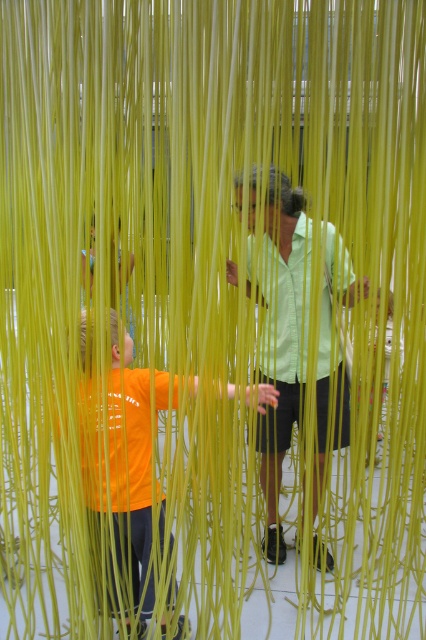
You are an artist planning to install a new sculpture between the orange matte shirt at center and the green textured shirt at center. Based on their positions, where should you place the sculpture so it is between them?

The orange matte shirt at center is located below the green textured shirt at center, so you should place the sculpture between them vertically, positioning it above the orange matte shirt at center and below the green textured shirt at center to ensure it is in between both shirts.

Based on the photo, you are standing in front of an interactive art installation with two points marked on the floor. The first point is at coordinate point (333, 244) and the second is at point (86, 458). If you want to touch both points starting from the nearest one to you, which point should you go to first?

You should go to point (86, 458) first because it is closer to you than point (333, 244), which is further away.